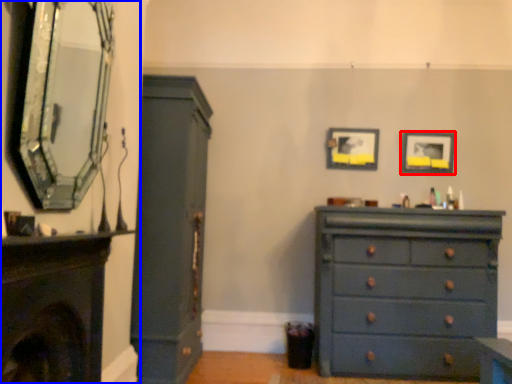
Question: Which object is closer to the camera taking this photo, picture frame (highlighted by a red box) or fireplace (highlighted by a blue box)?

Choices:
 (A) picture frame
 (B) fireplace

Answer: (B)